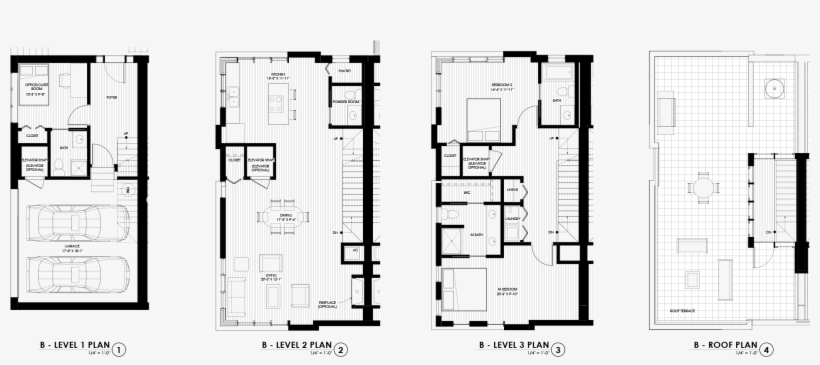
The image size is (820, 365). What are the coordinates of `room plans` in the screenshot? It's located at (11, 57), (216, 54), (435, 58), (649, 58).